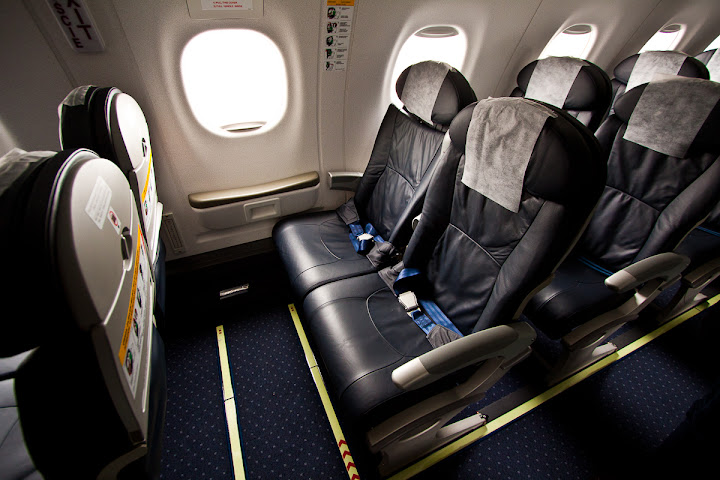
This screenshot has height=480, width=720. Identify the location of seats. (86, 274), (111, 132), (410, 158), (541, 242), (570, 85), (657, 67), (680, 135), (710, 62).